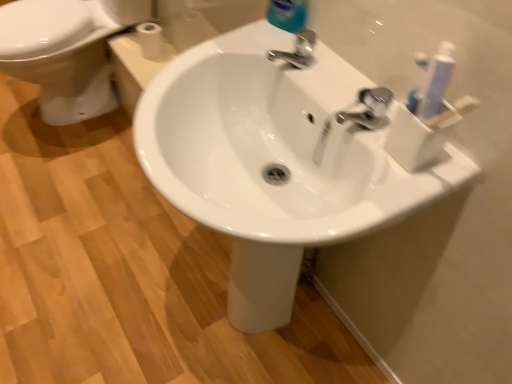
The width and height of the screenshot is (512, 384). I want to click on vacant space in front of silver metallic faucet at upper center, which is the 1th tap from left to right, so click(x=320, y=86).